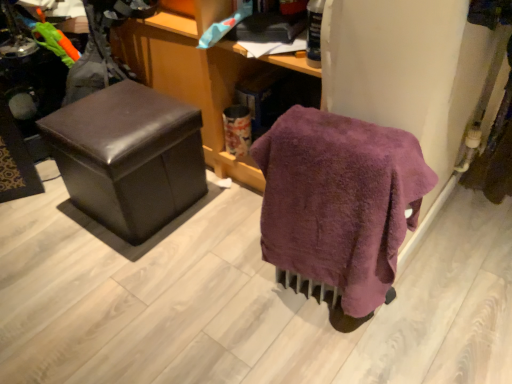
Question: Is purple terry cloth towel at lower right oriented away from matte brown ottoman at left?

Choices:
 (A) no
 (B) yes

Answer: (A)

Question: Does purple terry cloth towel at lower right have a lesser width compared to matte brown ottoman at left?

Choices:
 (A) yes
 (B) no

Answer: (A)

Question: Is purple terry cloth towel at lower right surrounding matte brown ottoman at left?

Choices:
 (A) yes
 (B) no

Answer: (B)

Question: Considering the relative positions of purple terry cloth towel at lower right and matte brown ottoman at left in the image provided, is purple terry cloth towel at lower right to the left of matte brown ottoman at left from the viewer's perspective?

Choices:
 (A) no
 (B) yes

Answer: (A)

Question: Is purple terry cloth towel at lower right behind matte brown ottoman at left?

Choices:
 (A) no
 (B) yes

Answer: (A)

Question: Can you confirm if purple terry cloth towel at lower right is positioned to the right of matte brown ottoman at left?

Choices:
 (A) no
 (B) yes

Answer: (B)

Question: Does matte brown ottoman at left have a lesser height compared to purple terry cloth towel at lower right?

Choices:
 (A) no
 (B) yes

Answer: (B)

Question: Considering the relative sizes of matte brown ottoman at left and purple terry cloth towel at lower right in the image provided, is matte brown ottoman at left thinner than purple terry cloth towel at lower right?

Choices:
 (A) no
 (B) yes

Answer: (A)

Question: Does matte brown ottoman at left contain purple terry cloth towel at lower right?

Choices:
 (A) yes
 (B) no

Answer: (B)

Question: Considering the relative sizes of matte brown ottoman at left and purple terry cloth towel at lower right in the image provided, is matte brown ottoman at left taller than purple terry cloth towel at lower right?

Choices:
 (A) no
 (B) yes

Answer: (A)

Question: Is matte brown ottoman at left smaller than purple terry cloth towel at lower right?

Choices:
 (A) yes
 (B) no

Answer: (B)

Question: Is matte brown ottoman at left positioned with its back to purple terry cloth towel at lower right?

Choices:
 (A) no
 (B) yes

Answer: (A)

Question: Is point (348, 223) closer or farther from the camera than point (150, 187)?

Choices:
 (A) closer
 (B) farther

Answer: (A)